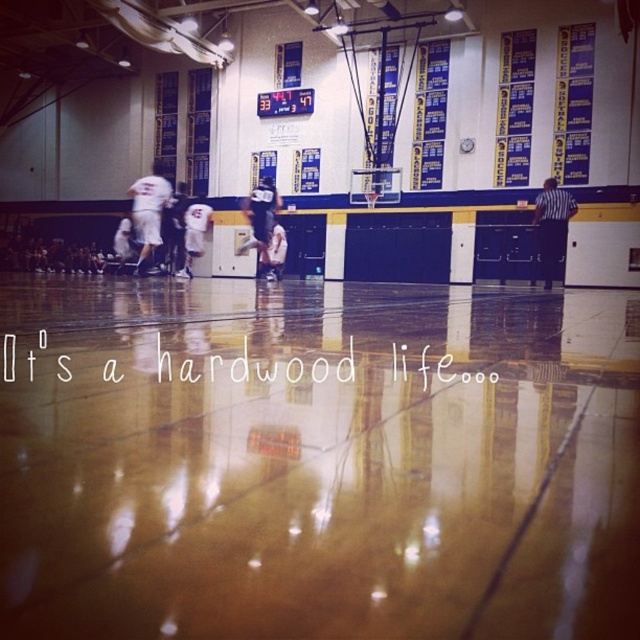
You are a photographer standing at the center of the basketball court. You want to take a photo of the black striped shirt at right. Based on its coordinates, in which direction should you move to get a better shot?

The black striped shirt at right is located at point 0.352 on the x and 0.863 on the y. Since the photographer is at the center, moving towards the right and forward would align the shot better.

You are a photographer standing at the back of the basketball court. You want to take a photo that includes both the white jersey basketball players at center and the white jersey at left. Which player should you focus on first if you want to ensure both are in the frame?

You should focus on the white jersey basketball players at center first because they are taller than the white jersey at left, making them more prominent in the frame.